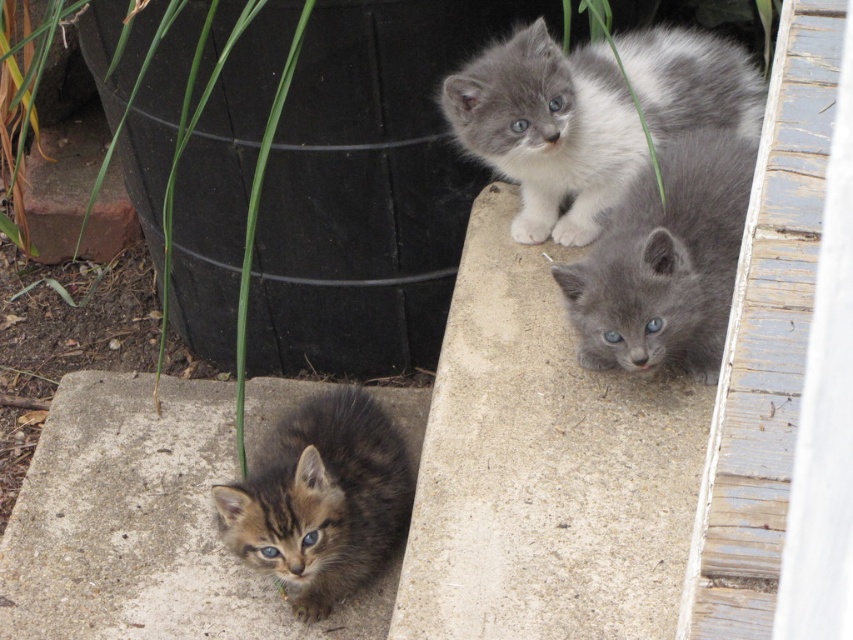
Between point (757, 74) and point (262, 440), which one is positioned behind?

The point (262, 440) is more distant.

Does gray fluffy kitten at upper center have a lesser width compared to tabby fur kitten at lower left?

Incorrect, gray fluffy kitten at upper center's width is not less than tabby fur kitten at lower left's.

You are a GUI agent. You are given a task and a screenshot of the screen. Output one action in this format:
    pyautogui.click(x=<x>, y=<y>)
    Task: Click on the gray fluffy kitten at upper center
    
    Given the screenshot: What is the action you would take?
    pyautogui.click(x=590, y=115)

How far apart are gray concrete at upper center and tabby fur kitten at lower left?

A distance of 15.25 inches exists between gray concrete at upper center and tabby fur kitten at lower left.

Is gray concrete at upper center further to camera compared to tabby fur kitten at lower left?

No, it is not.

Identify the location of gray concrete at upper center. (543, 467).

Locate an element on the screen. This screenshot has width=853, height=640. gray concrete at upper center is located at coordinates (543, 467).

Does gray fluffy kitten at upper center come behind gray fluffy kitten at upper right?

Yes, it is behind gray fluffy kitten at upper right.

Which is in front, point (669, 104) or point (611, 332)?

Point (611, 332) is more forward.

What are the coordinates of `gray fluffy kitten at upper center` in the screenshot? It's located at (590, 115).